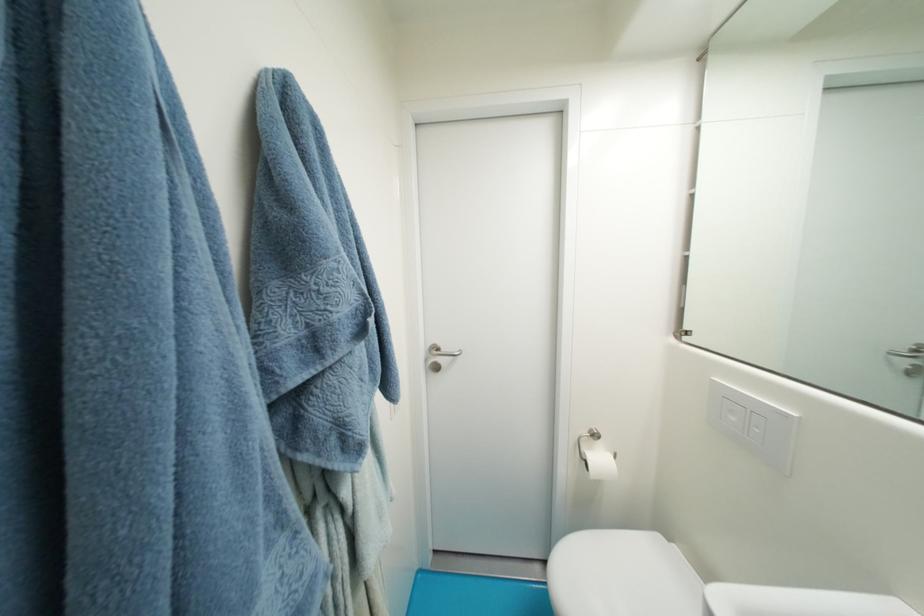
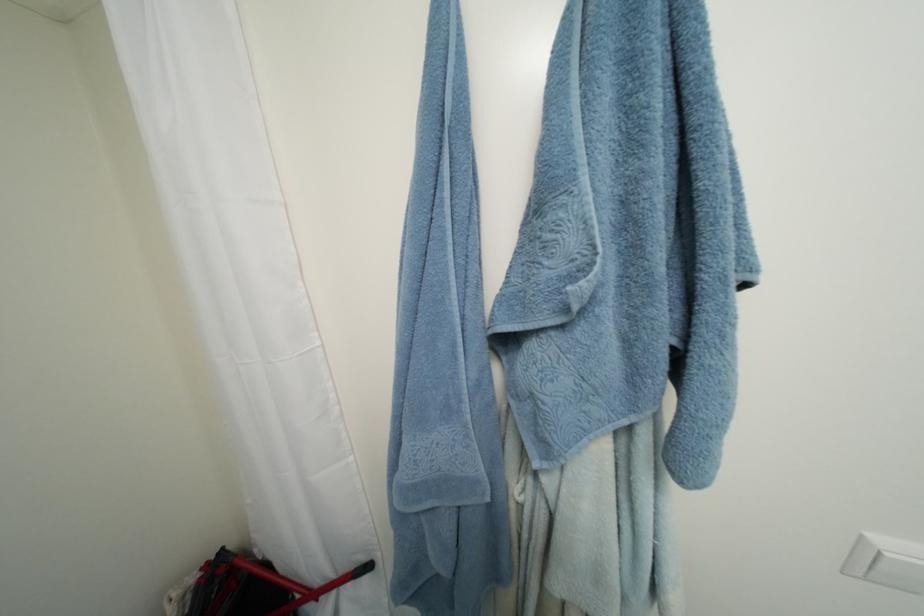
The first image is from the beginning of the video and the second image is from the end. How did the camera likely rotate when shooting the video?

The rotation direction of the camera is left-down.